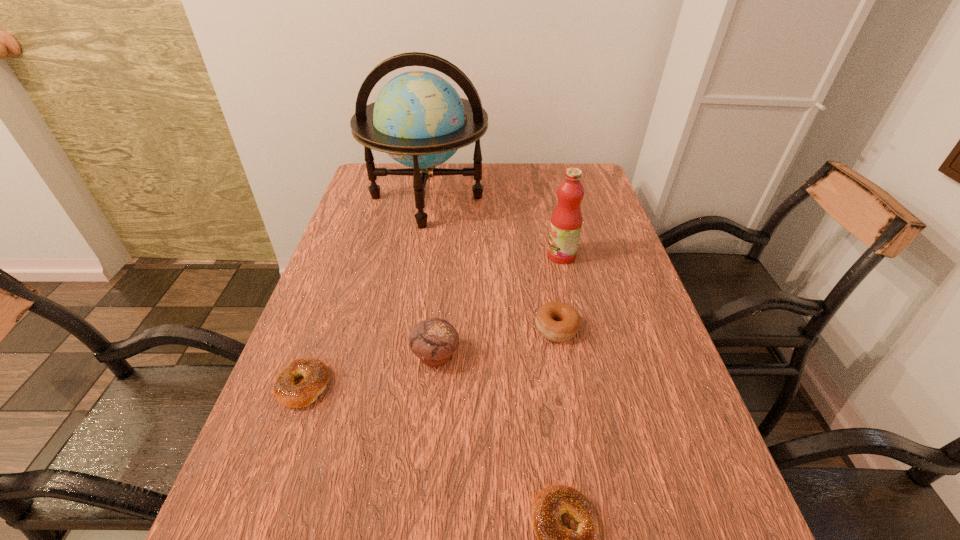
Where is `object that stands as the closest to the farthest object`? object that stands as the closest to the farthest object is located at coordinates tap(566, 221).

You are a GUI agent. You are given a task and a screenshot of the screen. Output one action in this format:
    pyautogui.click(x=<x>, y=<y>)
    Task: Click on the third closest object to the fruit juice
    This screenshot has width=960, height=540.
    Given the screenshot: What is the action you would take?
    (434, 340)

Select which bagel is the closest to the nearest object. Please provide its 2D coordinates. Your answer should be formatted as a tuple, i.e. [(x, y)], where the tuple contains the x and y coordinates of a point satisfying the conditions above.

[(559, 322)]

Find the location of a particular element. the second closest bagel to the tallest object is located at coordinates (316, 375).

I want to click on free location that satisfies the following two spatial constraints: 1. on the surface of the globe; 2. on the left side of the farthest bagel, so click(x=404, y=328).

Identify the location of vacant space that satisfies the following two spatial constraints: 1. on the surface of the farthest bagel; 2. on the left side of the tallest object. (404, 328).

Image resolution: width=960 pixels, height=540 pixels. I want to click on free space that satisfies the following two spatial constraints: 1. on the front label of the second farthest object; 2. on the front side of the muffin, so click(584, 355).

The width and height of the screenshot is (960, 540). In order to click on free space that satisfies the following two spatial constraints: 1. on the back side of the third tallest object; 2. on the right side of the leftmost bagel in this screenshot , I will do `click(315, 355)`.